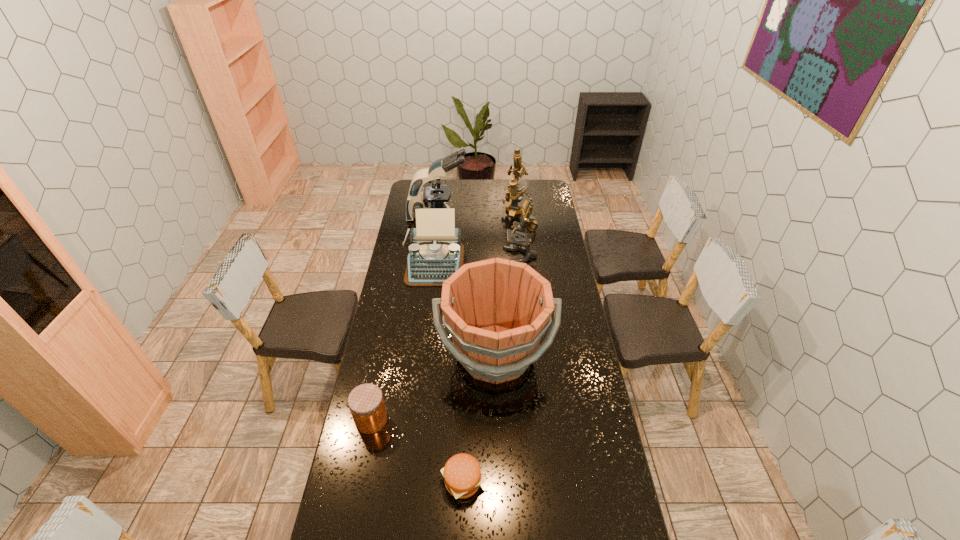
Locate an element on the screen. This screenshot has width=960, height=540. free region that satisfies the following two spatial constraints: 1. on the typing side of the hamburger; 2. on the right side of the third shortest object is located at coordinates pyautogui.click(x=409, y=482).

Identify the location of vacant space that satisfies the following two spatial constraints: 1. at the eyepieces of the nearest microscope; 2. on the handle side of the fifth farthest object. pos(531,354).